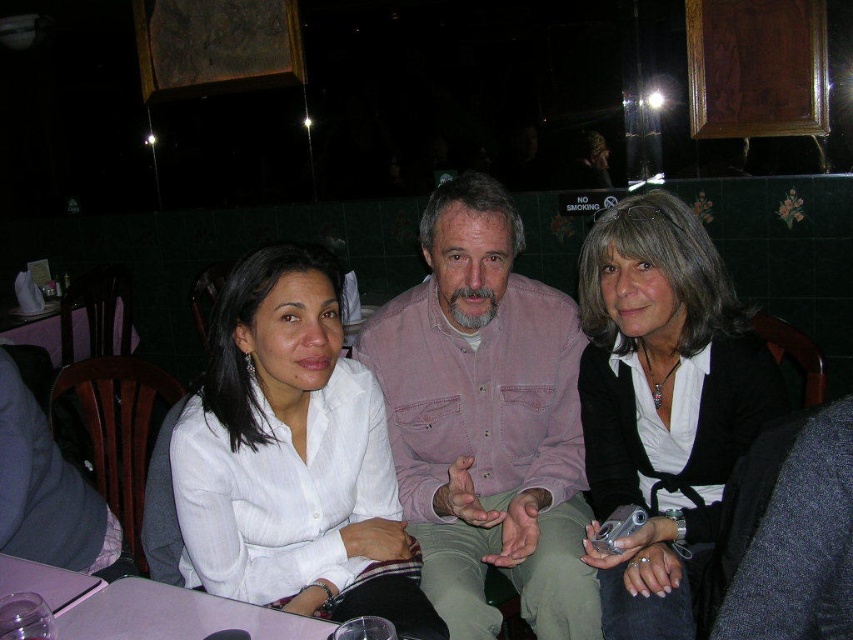
Is white cotton shirt at center bigger than matte black camera at center?

Incorrect, white cotton shirt at center is not larger than matte black camera at center.

The height and width of the screenshot is (640, 853). What are the coordinates of `white cotton shirt at center` in the screenshot? It's located at (293, 456).

Is pink cotton shirt at center bigger than white cotton shirt at center?

Yes, pink cotton shirt at center is bigger than white cotton shirt at center.

Which is behind, point (409, 422) or point (352, 388)?

The point (409, 422) is more distant.

Identify the location of pink cotton shirt at center. (486, 420).

Does pink cotton shirt at center appear on the left side of matte black camera at center?

Indeed, pink cotton shirt at center is positioned on the left side of matte black camera at center.

Who is taller, pink cotton shirt at center or matte black camera at center?

pink cotton shirt at center is taller.

Locate an element on the screen. The height and width of the screenshot is (640, 853). pink cotton shirt at center is located at coordinates (486, 420).